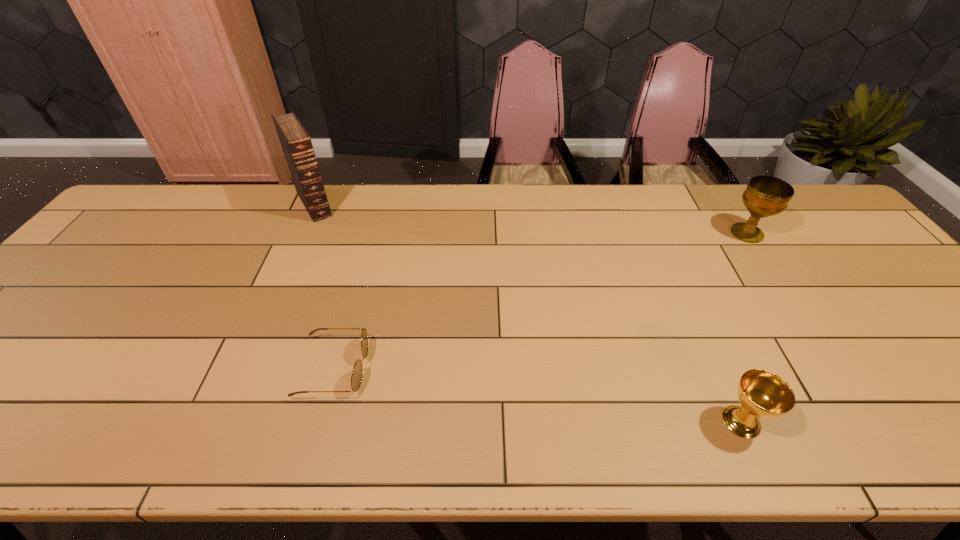
Identify the location of the leftmost object. The height and width of the screenshot is (540, 960). (296, 143).

Locate an element on the screen. Image resolution: width=960 pixels, height=540 pixels. the tallest object is located at coordinates (296, 143).

This screenshot has width=960, height=540. Find the location of `the rightmost object`. the rightmost object is located at coordinates (765, 196).

Find the location of `the right chalice`. the right chalice is located at coordinates (765, 196).

Locate an element on the screen. This screenshot has width=960, height=540. the shorter chalice is located at coordinates (763, 394).

Find the location of a particular element. This screenshot has width=960, height=540. the second object from right to left is located at coordinates (763, 394).

Locate an element on the screen. This screenshot has width=960, height=540. the shortest object is located at coordinates (356, 378).

Find the location of `sunglasses`. sunglasses is located at coordinates (356, 378).

This screenshot has height=540, width=960. What are the coordinates of `vacant area located 0.380m on the front of the tallest object` in the screenshot? It's located at (263, 318).

Where is `free location located 0.260m on the front of the second tallest object`? This screenshot has width=960, height=540. free location located 0.260m on the front of the second tallest object is located at coordinates (801, 314).